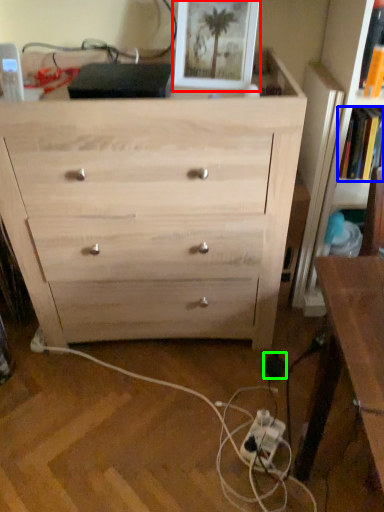
Question: Considering the real-world distances, which object is farthest from picture frame (highlighted by a red box)? book (highlighted by a blue box) or electric outlet (highlighted by a green box)?

Choices:
 (A) book
 (B) electric outlet

Answer: (B)